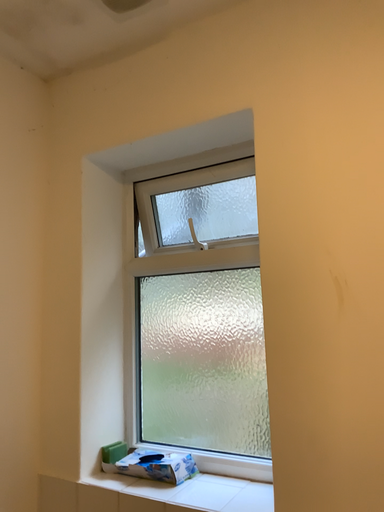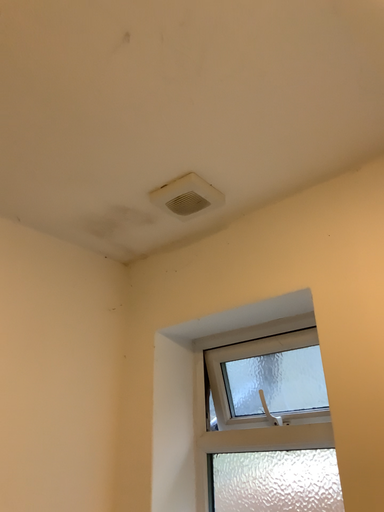
Question: Which way did the camera rotate in the video?

Choices:
 (A) rotated downward
 (B) rotated upward

Answer: (B)